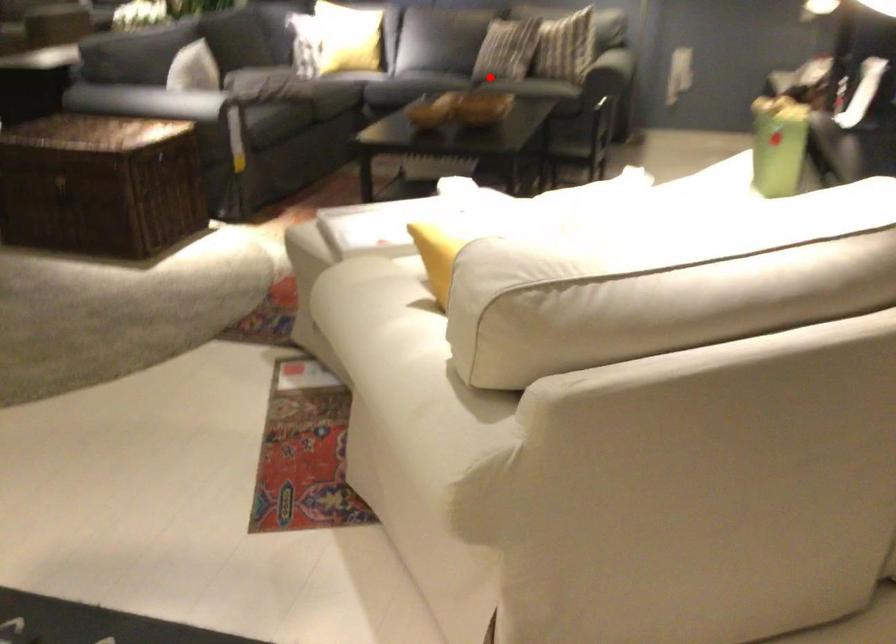
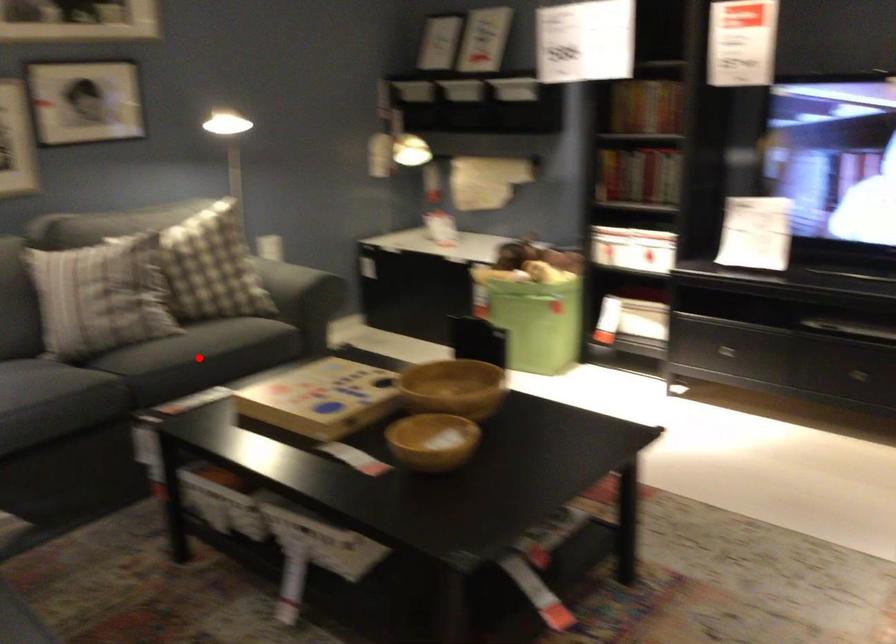
From the picture: I am providing you with two images of the same scene from different viewpoints. A red point is marked on the first image and another point is marked on the second image. Are the points marked in image1 and image2 representing the same 3D position?

Yes